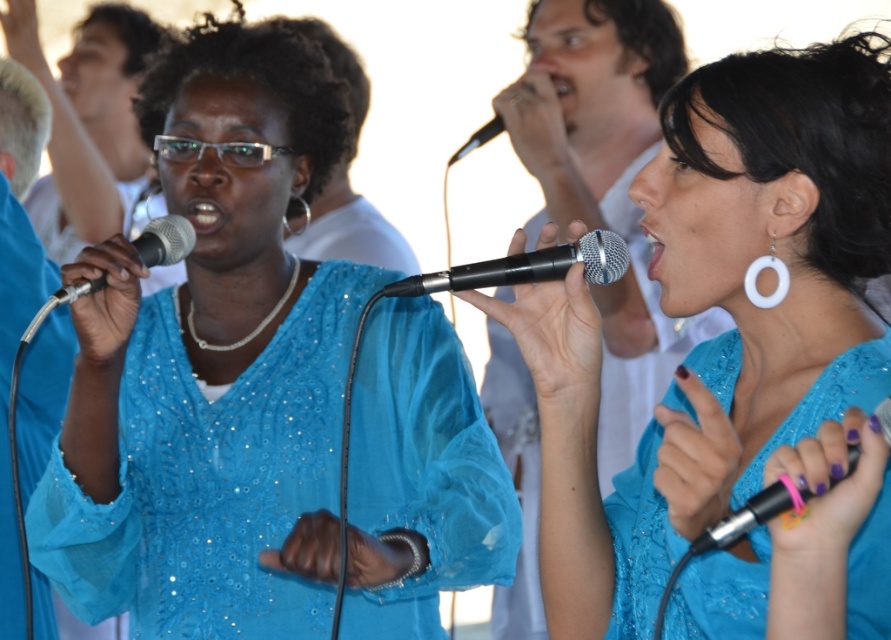
From the picture: Is the position of matte blue blouse at center less distant than that of metallic silver microphone at center?

No, it is behind metallic silver microphone at center.

Is matte blue blouse at center wider than metallic silver microphone at center?

Yes.

This screenshot has height=640, width=891. Find the location of `matte blue blouse at center`. matte blue blouse at center is located at coordinates (211, 364).

Is point (848, 364) farther from viewer compared to point (887, 422)?

Yes, point (848, 364) is farther from viewer.

Is matte blue dress at center wider than metallic silver microphone at center?

Yes.

Where is `matte blue dress at center`? This screenshot has height=640, width=891. matte blue dress at center is located at coordinates (725, 332).

The height and width of the screenshot is (640, 891). I want to click on matte blue dress at center, so click(x=725, y=332).

Who is shorter, black metallic microphone at center or matte black microphone at left?

black metallic microphone at center is shorter.

Does point (462, 284) come in front of point (79, 291)?

Yes, it is.

Is point (612, 241) farther from viewer compared to point (64, 289)?

No, (612, 241) is closer to viewer.

The width and height of the screenshot is (891, 640). I want to click on black metallic microphone at center, so click(524, 268).